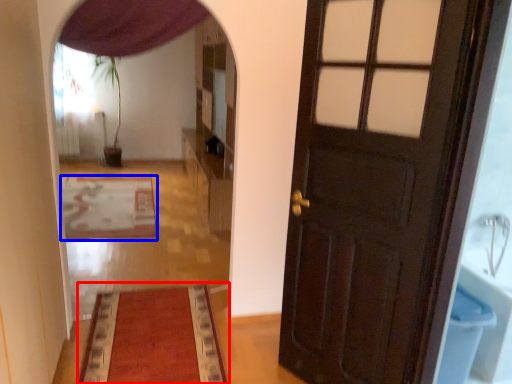
Question: Among these objects, which one is farthest to the camera, mat (highlighted by a red box) or mat (highlighted by a blue box)?

Choices:
 (A) mat
 (B) mat

Answer: (B)